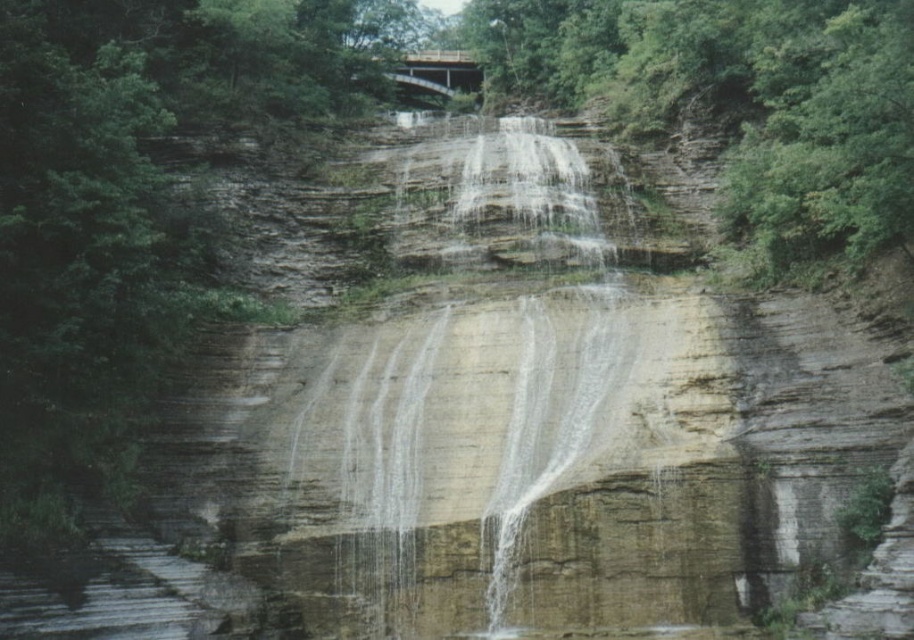
What do you see at coordinates (460, 388) in the screenshot? I see `white textured water at center` at bounding box center [460, 388].

Does point (528, 452) lie in front of point (420, 58)?

Yes, it is in front of point (420, 58).

The height and width of the screenshot is (640, 914). I want to click on white textured water at center, so click(460, 388).